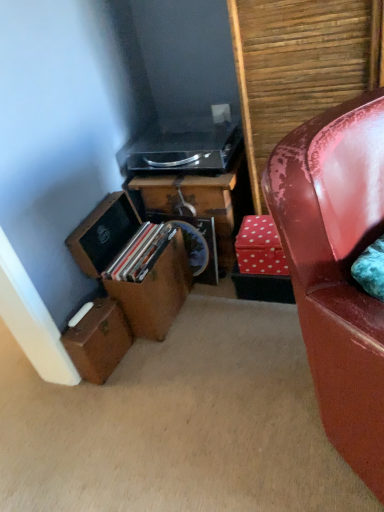
Question: From the image's perspective, is wooden box at lower left, the second box positioned from the bottom, located above brown leather suitcase at lower left, placed as the first box when sorted from bottom to top?

Choices:
 (A) no
 (B) yes

Answer: (B)

Question: Is wooden box at lower left, the second box positioned from the bottom, far from brown leather suitcase at lower left, acting as the second box starting from the top?

Choices:
 (A) yes
 (B) no

Answer: (B)

Question: Is wooden box at lower left, the second box positioned from the bottom, turned away from brown leather suitcase at lower left, acting as the second box starting from the top?

Choices:
 (A) yes
 (B) no

Answer: (B)

Question: Considering the relative positions of wooden box at lower left, the first box in the top-to-bottom sequence, and brown leather suitcase at lower left, placed as the first box when sorted from bottom to top, in the image provided, is wooden box at lower left, the first box in the top-to-bottom sequence, to the left of brown leather suitcase at lower left, placed as the first box when sorted from bottom to top, from the viewer's perspective?

Choices:
 (A) no
 (B) yes

Answer: (A)

Question: Considering the relative positions of wooden box at lower left, the first box in the top-to-bottom sequence, and brown leather suitcase at lower left, acting as the second box starting from the top, in the image provided, is wooden box at lower left, the first box in the top-to-bottom sequence, behind brown leather suitcase at lower left, acting as the second box starting from the top,?

Choices:
 (A) yes
 (B) no

Answer: (B)

Question: Is brown leather suitcase at lower left, placed as the first box when sorted from bottom to top, inside the boundaries of black plastic stereo at upper center, or outside?

Choices:
 (A) inside
 (B) outside

Answer: (B)

Question: Considering the positions of brown leather suitcase at lower left, acting as the second box starting from the top, and black plastic stereo at upper center in the image, is brown leather suitcase at lower left, acting as the second box starting from the top, wider or thinner than black plastic stereo at upper center?

Choices:
 (A) wide
 (B) thin

Answer: (B)

Question: Based on their positions, is brown leather suitcase at lower left, placed as the first box when sorted from bottom to top, located to the left or right of black plastic stereo at upper center?

Choices:
 (A) right
 (B) left

Answer: (B)

Question: From a real-world perspective, is brown leather suitcase at lower left, placed as the first box when sorted from bottom to top, positioned above or below black plastic stereo at upper center?

Choices:
 (A) above
 (B) below

Answer: (B)

Question: Is brown leather suitcase at lower left, acting as the second box starting from the top, taller or shorter than wooden box at lower left, the second box positioned from the bottom?

Choices:
 (A) short
 (B) tall

Answer: (A)

Question: Considering the positions of brown leather suitcase at lower left, acting as the second box starting from the top, and wooden box at lower left, the second box positioned from the bottom, in the image, is brown leather suitcase at lower left, acting as the second box starting from the top, wider or thinner than wooden box at lower left, the second box positioned from the bottom,?

Choices:
 (A) wide
 (B) thin

Answer: (B)

Question: Considering the relative positions of brown leather suitcase at lower left, placed as the first box when sorted from bottom to top, and wooden box at lower left, the first box in the top-to-bottom sequence, in the image provided, is brown leather suitcase at lower left, placed as the first box when sorted from bottom to top, to the left or to the right of wooden box at lower left, the first box in the top-to-bottom sequence,?

Choices:
 (A) right
 (B) left

Answer: (B)

Question: From a real-world perspective, is brown leather suitcase at lower left, placed as the first box when sorted from bottom to top, above or below wooden box at lower left, the first box in the top-to-bottom sequence?

Choices:
 (A) below
 (B) above

Answer: (A)

Question: In the image, is wooden box at lower left, the first box in the top-to-bottom sequence, on the left side or the right side of red polka dot cardboard box at center?

Choices:
 (A) left
 (B) right

Answer: (A)

Question: From the image's perspective, is wooden box at lower left, the first box in the top-to-bottom sequence, positioned above or below red polka dot cardboard box at center?

Choices:
 (A) above
 (B) below

Answer: (B)